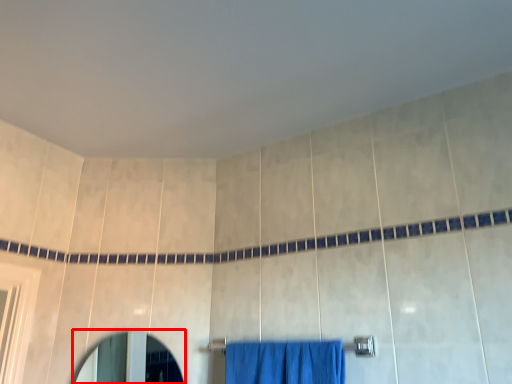
Question: From the image's perspective, what is the correct spatial positioning of mirror (annotated by the red box) in reference to towel bar?

Choices:
 (A) above
 (B) below

Answer: (B)